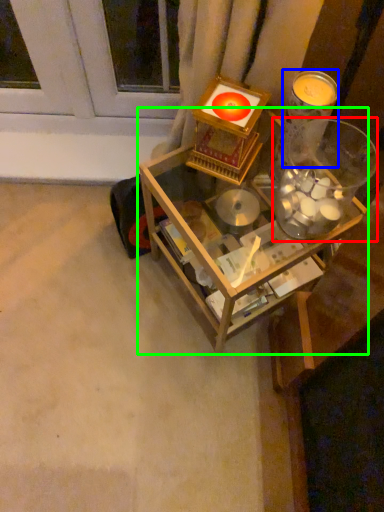
Question: Estimate the real-world distances between objects in this image. Which object is farther from glass jar (highlighted by a red box), candle holder (highlighted by a blue box) or table (highlighted by a green box)?

Choices:
 (A) candle holder
 (B) table

Answer: (B)